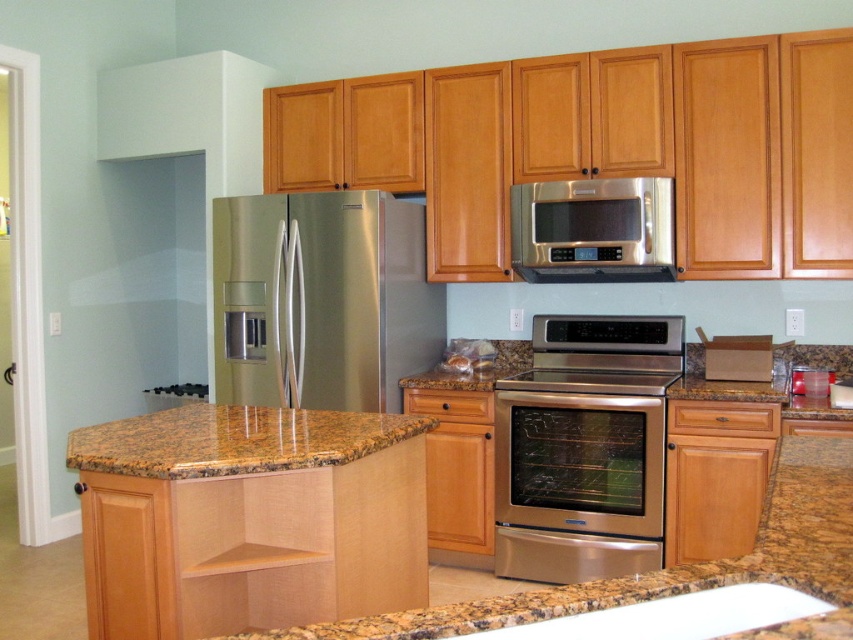
Question: Is stainless steel refrigerator at center smaller than granite at center?

Choices:
 (A) no
 (B) yes

Answer: (A)

Question: Among these points, which one is nearest to the camera?

Choices:
 (A) (596, 237)
 (B) (364, 300)
 (C) (595, 349)

Answer: (A)

Question: Is stainless steel oven at center positioned in front of stainless steel microwave at upper center?

Choices:
 (A) no
 (B) yes

Answer: (B)

Question: Does stainless steel refrigerator at center appear over stainless steel oven at center?

Choices:
 (A) no
 (B) yes

Answer: (B)

Question: Which point is closer to the camera?

Choices:
 (A) stainless steel microwave at upper center
 (B) white matte exhaust hood at upper left

Answer: (A)

Question: Which of the following is the closest to the observer?

Choices:
 (A) (376, 444)
 (B) (614, 566)

Answer: (A)